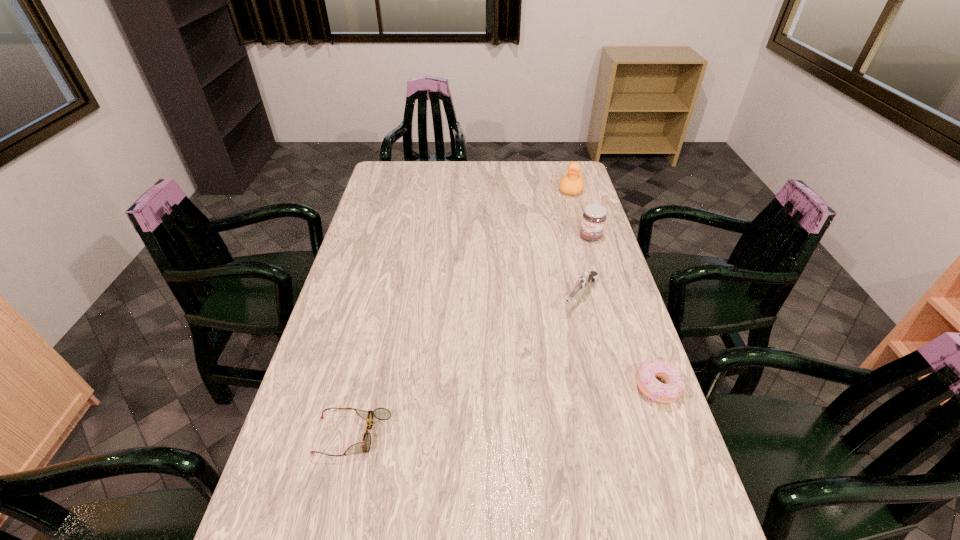
In order to click on vacant space on the desktop that is between the spectacles and the doughnut and is positioned aimed along the barrel of the third tallest object in this screenshot , I will do tap(489, 414).

Where is `vacant spot on the desktop that is between the leftmost object and the fourth farthest object and is positioned on the face of the duck`? The height and width of the screenshot is (540, 960). vacant spot on the desktop that is between the leftmost object and the fourth farthest object and is positioned on the face of the duck is located at coordinates (510, 411).

This screenshot has width=960, height=540. I want to click on vacant space on the desktop that is between the spectacles and the second nearest object and is positioned on the front label of the fourth nearest object, so click(x=467, y=417).